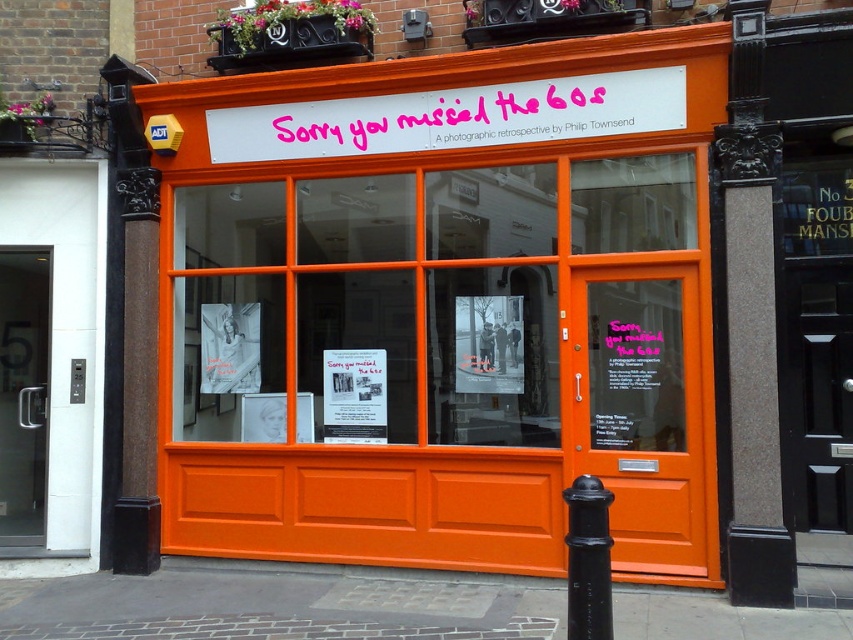
Consider the image. Between white plastic signboard at upper center and black matte pole at lower right, which one has less height?

white plastic signboard at upper center

Is white plastic signboard at upper center wider than black matte pole at lower right?

Indeed, white plastic signboard at upper center has a greater width compared to black matte pole at lower right.

Does point (215, 125) come closer to viewer compared to point (593, 490)?

No, (215, 125) is behind (593, 490).

Locate an element on the screen. The height and width of the screenshot is (640, 853). white plastic signboard at upper center is located at coordinates (451, 116).